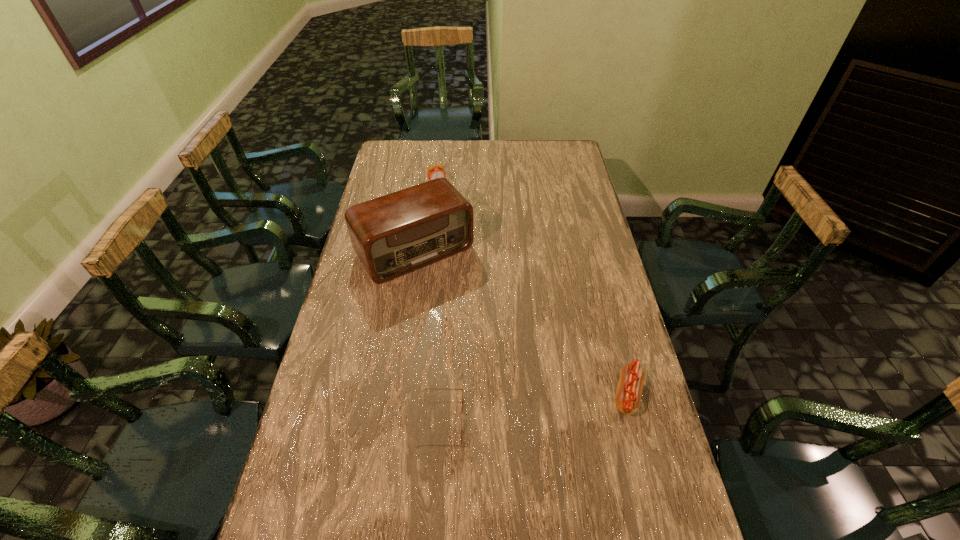
The height and width of the screenshot is (540, 960). What are the coordinates of `free space that satisfies the following two spatial constraints: 1. on the back side of the third nearest object; 2. on the right side of the alarm clock` in the screenshot? It's located at (x=425, y=184).

Where is `vacant area in the image that satisfies the following two spatial constraints: 1. on the front side of the rightmost object; 2. on the left side of the third nearest object`? The height and width of the screenshot is (540, 960). vacant area in the image that satisfies the following two spatial constraints: 1. on the front side of the rightmost object; 2. on the left side of the third nearest object is located at coordinates pos(393,395).